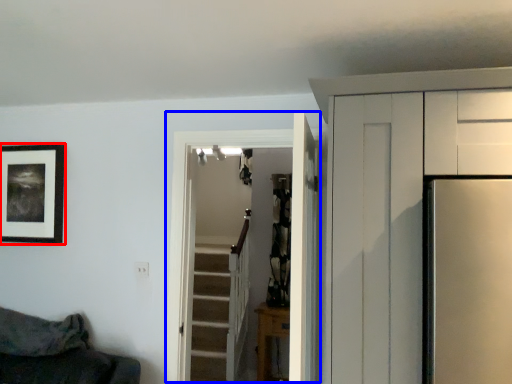
Question: Which object is further to the camera taking this photo, picture frame (highlighted by a red box) or door (highlighted by a blue box)?

Choices:
 (A) picture frame
 (B) door

Answer: (A)